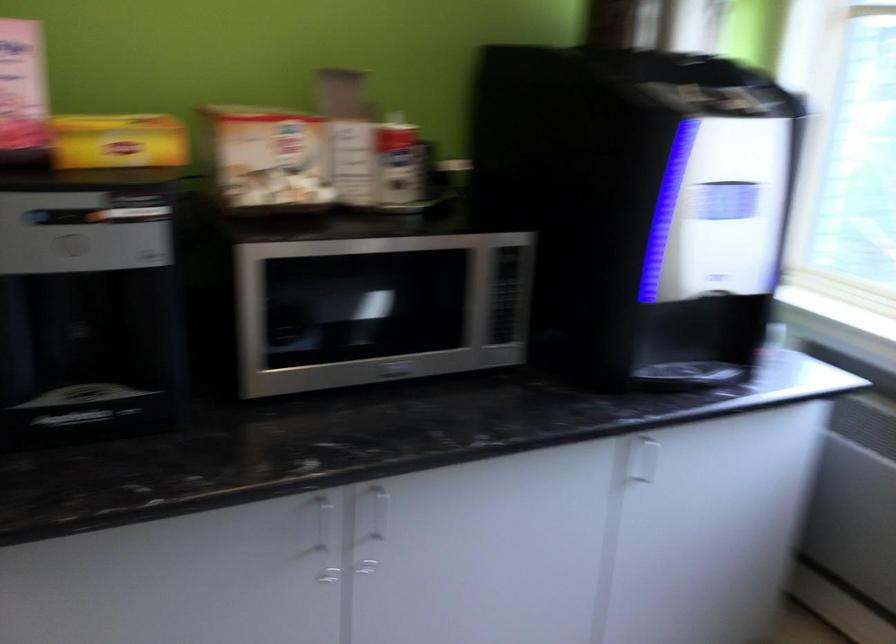
Locate an element on the screen. The image size is (896, 644). white cardboard box is located at coordinates (270, 156).